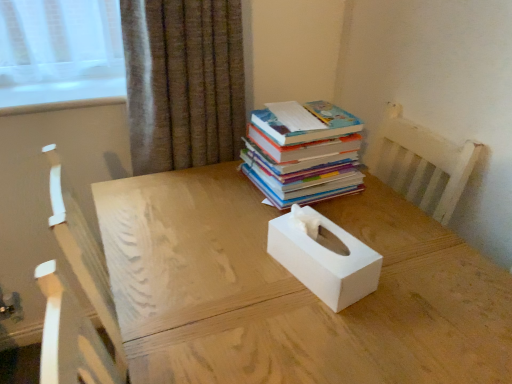
Identify the location of space that is in front of hardcover books at upper right. This screenshot has width=512, height=384. (276, 214).